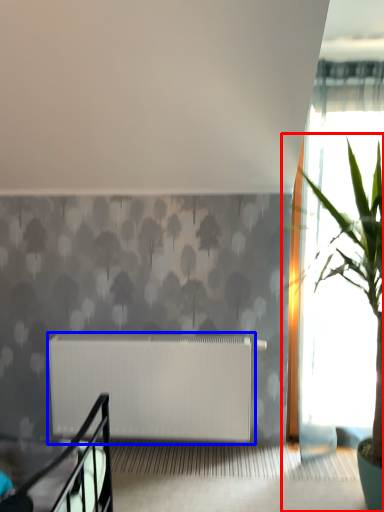
Question: Which object appears closest to the camera in this image, houseplant (highlighted by a red box) or radiator (highlighted by a blue box)?

Choices:
 (A) houseplant
 (B) radiator

Answer: (A)